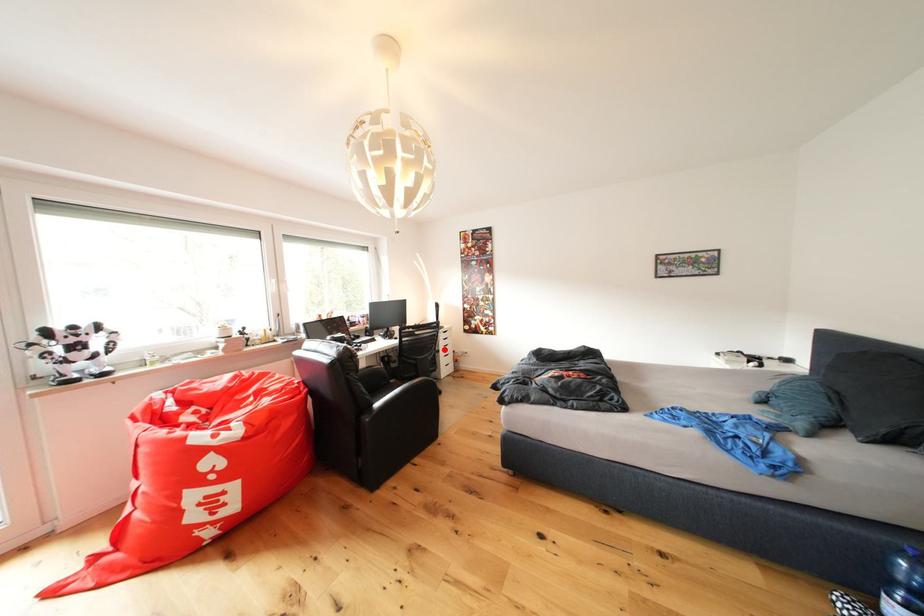
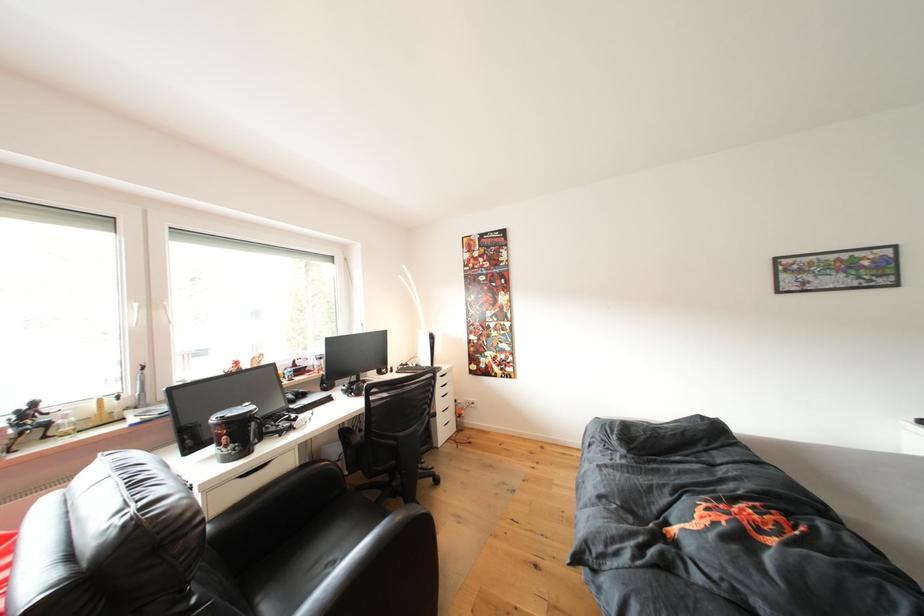
In the second image, find the point that corresponds to the highlighted location in the first image.

(439, 411)